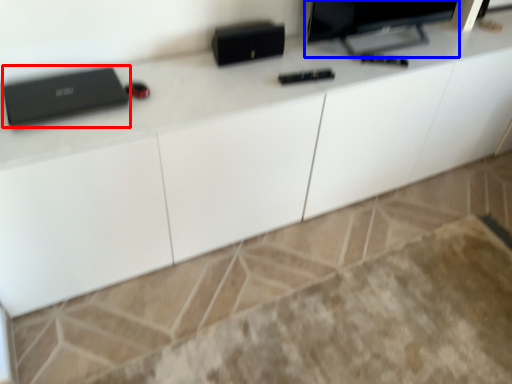
Question: Which object is closer to the camera taking this photo, laptop (highlighted by a red box) or computer monitor (highlighted by a blue box)?

Choices:
 (A) laptop
 (B) computer monitor

Answer: (A)